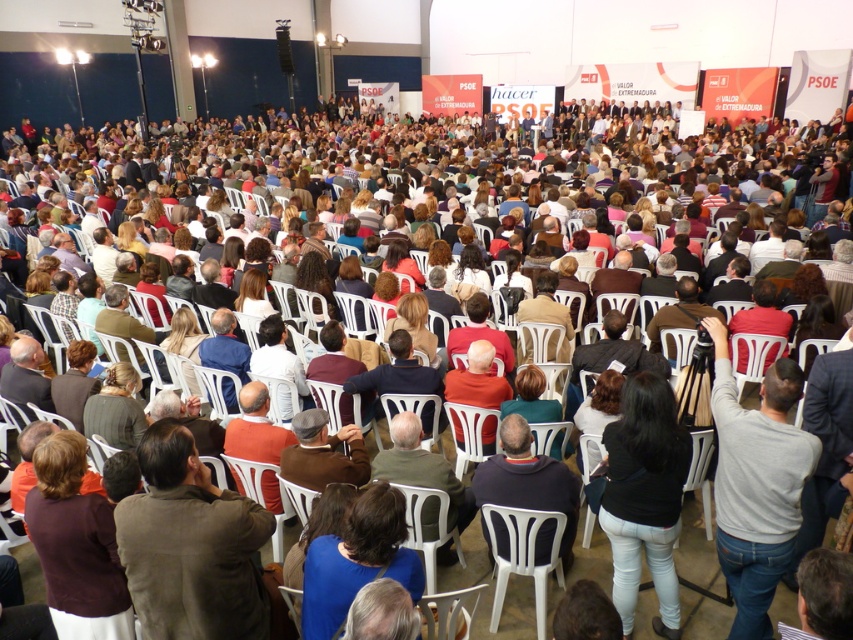
Who is more forward, (659, 408) or (247, 442)?

Point (659, 408) is in front.

Measure the distance between point [619,547] and camera.

Point [619,547] is 11.80 feet from camera.

Identify the location of black denim jeans at lower center. The image size is (853, 640). (643, 497).

Locate an element on the screen. black denim jeans at lower center is located at coordinates (643, 497).

Can you confirm if black denim jeans at lower center is smaller than brown sweater at lower left?

No.

Can you confirm if black denim jeans at lower center is shorter than brown sweater at lower left?

In fact, black denim jeans at lower center may be taller than brown sweater at lower left.

Is point (662, 468) closer to camera compared to point (62, 582)?

No, (662, 468) is behind (62, 582).

Locate an element on the screen. black denim jeans at lower center is located at coordinates (643, 497).

Does blue fabric at center have a smaller size compared to orange fabric shirt at center?

Indeed, blue fabric at center has a smaller size compared to orange fabric shirt at center.

Which is above, blue fabric at center or orange fabric shirt at center?

orange fabric shirt at center is above.

Find the location of `blue fabric at center`. blue fabric at center is located at coordinates (357, 561).

Find the location of a particular element. The width and height of the screenshot is (853, 640). blue fabric at center is located at coordinates (357, 561).